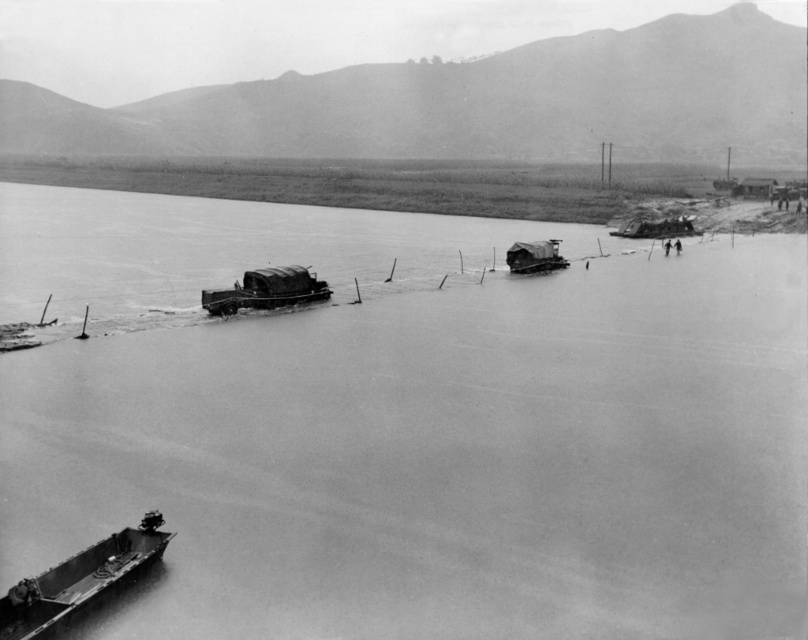
Is smooth water at center taller than wooden planks boat at center?

Correct, smooth water at center is much taller as wooden planks boat at center.

Can you confirm if smooth water at center is thinner than wooden planks boat at center?

Incorrect, smooth water at center's width is not less than wooden planks boat at center's.

The image size is (808, 640). Describe the element at coordinates (409, 426) in the screenshot. I see `smooth water at center` at that location.

Where is `smooth water at center`? This screenshot has height=640, width=808. smooth water at center is located at coordinates (409, 426).

Consider the image. Does metallic gray boat at center have a greater width compared to metallic gray boat at right?

Incorrect, metallic gray boat at center's width does not surpass metallic gray boat at right's.

Can you confirm if metallic gray boat at center is thinner than metallic gray boat at right?

Yes, metallic gray boat at center is thinner than metallic gray boat at right.

Does point (259, 276) lie in front of point (636, 228)?

Yes, point (259, 276) is in front of point (636, 228).

Locate an element on the screen. This screenshot has width=808, height=640. metallic gray boat at center is located at coordinates (266, 291).

Does smooth wooden boat at lower left have a larger size compared to wooden planks boat at center?

Incorrect, smooth wooden boat at lower left is not larger than wooden planks boat at center.

Is point (5, 609) in front of point (506, 262)?

Yes, point (5, 609) is closer to viewer.

The image size is (808, 640). Identify the location of smooth wooden boat at lower left. (80, 580).